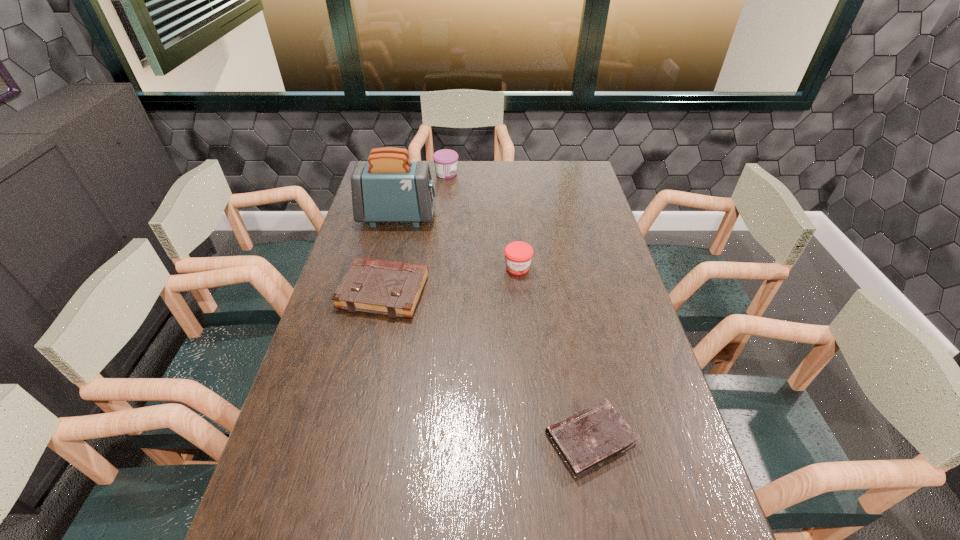
The height and width of the screenshot is (540, 960). I want to click on free space located 0.350m on the front label of the farther jam, so tap(540, 173).

Identify the location of vacant space located on the label side of the shorter jam. The height and width of the screenshot is (540, 960). (527, 370).

Identify the location of vacant space located 0.400m on the back of the fourth tallest object. The width and height of the screenshot is (960, 540). (404, 200).

Locate an element on the screen. Image resolution: width=960 pixels, height=540 pixels. vacant space situated 0.070m on the front of the shortest object is located at coordinates (605, 515).

Locate an element on the screen. The width and height of the screenshot is (960, 540). object positioned at the far edge is located at coordinates (445, 160).

Identify the location of toaster at the left edge. Image resolution: width=960 pixels, height=540 pixels. (388, 187).

The height and width of the screenshot is (540, 960). I want to click on hardback book that is at the left edge, so click(391, 288).

Image resolution: width=960 pixels, height=540 pixels. I want to click on object that is at the right edge, so click(x=587, y=439).

In the image, there is a desktop. Identify the location of free space at the left edge. This screenshot has height=540, width=960. (368, 325).

Identify the location of vacant space at the far right corner of the desktop. The image size is (960, 540). (550, 166).